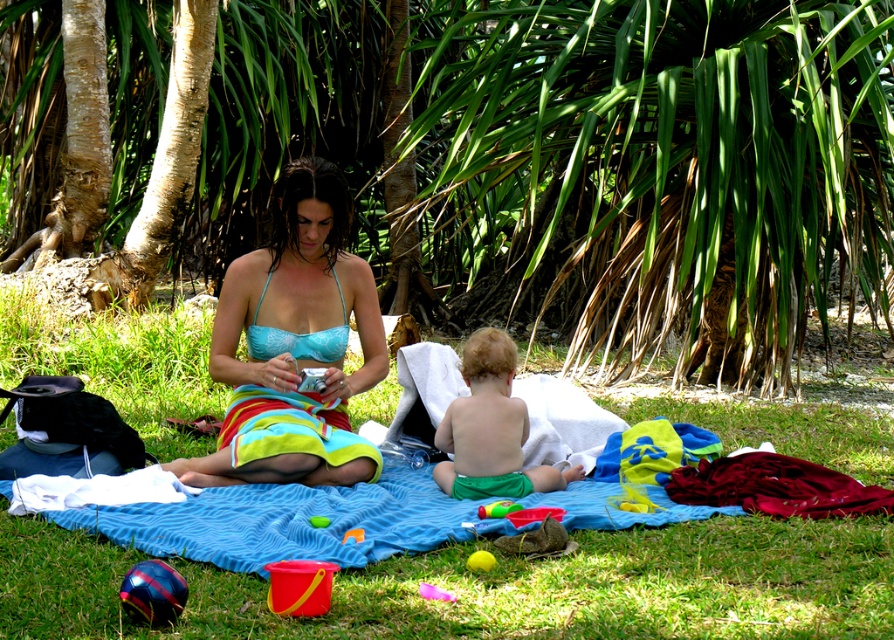
Based on the photo, who is lower down, blue textured bikini top at center or rubber pink ball at lower center?

rubber pink ball at lower center is lower down.

Does blue textured bikini top at center have a lesser height compared to rubber pink ball at lower center?

No, blue textured bikini top at center is not shorter than rubber pink ball at lower center.

Is point (304, 356) farther from viewer compared to point (426, 589)?

Yes.

At what (x,y) coordinates should I click in order to perform the action: click on blue textured bikini top at center. Please return your answer as a coordinate pair (x, y). This screenshot has width=894, height=640. Looking at the image, I should click on (297, 336).

Does green leafy palm tree at center have a greater width compared to green cotton shorts at center?

Incorrect, green leafy palm tree at center's width does not surpass green cotton shorts at center's.

Which is above, green leafy palm tree at center or green cotton shorts at center?

green leafy palm tree at center is higher up.

Who is more distant from viewer, (x=536, y=273) or (x=499, y=435)?

The point (x=536, y=273) is behind.

In order to click on green leafy palm tree at center in this screenshot , I will do `click(660, 172)`.

Is matte blue bikini top at center taller than blue textured bikini top at center?

Yes.

Is the position of matte blue bikini top at center more distant than that of blue textured bikini top at center?

No, it is in front of blue textured bikini top at center.

Where is `matte blue bikini top at center`? The image size is (894, 640). matte blue bikini top at center is located at coordinates (294, 346).

At what (x,y) coordinates should I click in order to perform the action: click on matte blue bikini top at center. Please return your answer as a coordinate pair (x, y). Image resolution: width=894 pixels, height=640 pixels. Looking at the image, I should click on (294, 346).